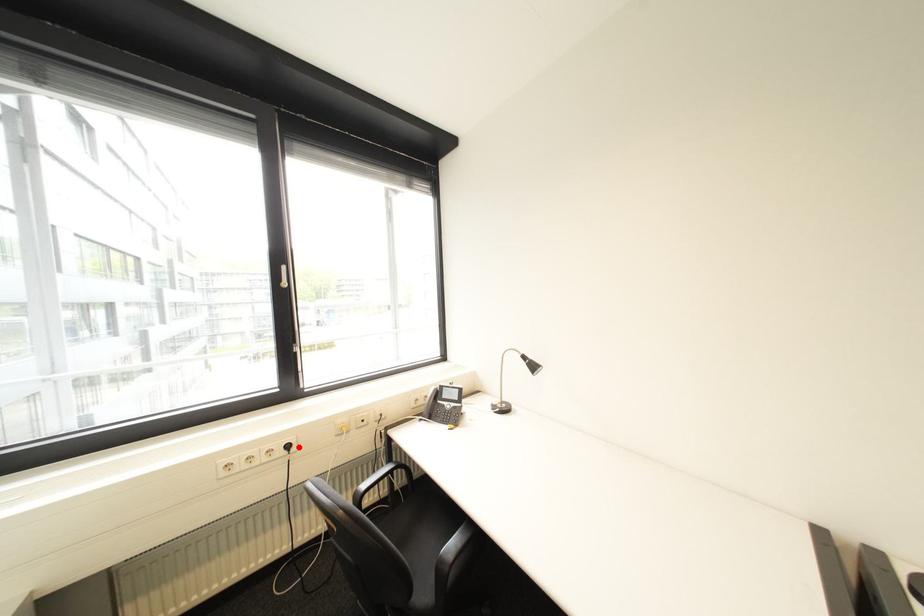
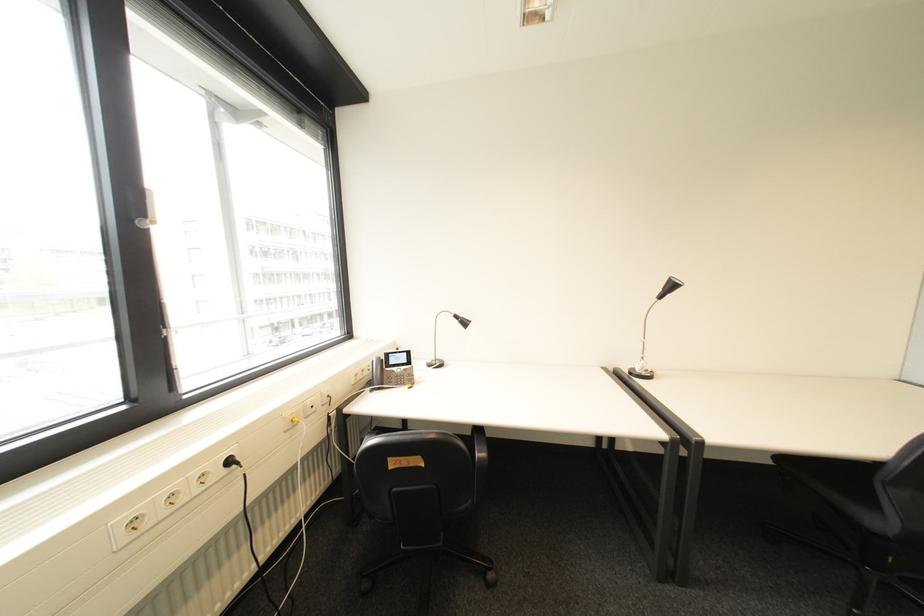
The point at the highlighted location is marked in the first image. Where is the corresponding point in the second image?

(239, 463)